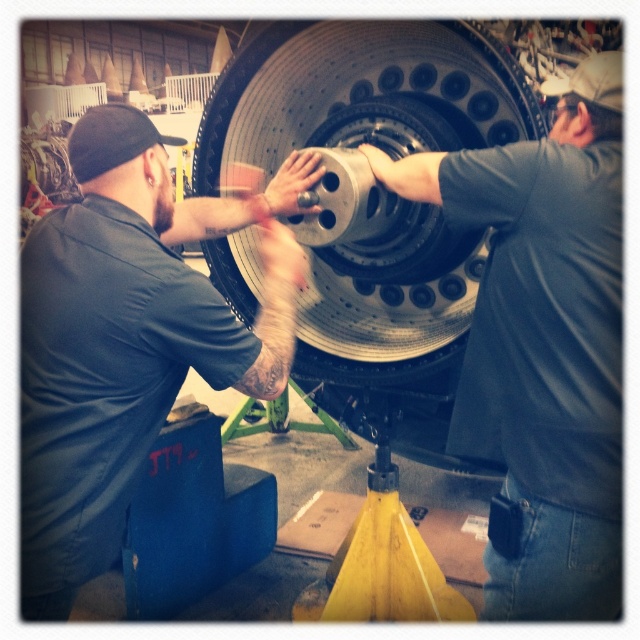
You are an inspector in the aircraft maintenance facility. You need to access the metallic silver tire at center for inspection. Is the matte black shirt at left blocking your direct path to it?

The matte black shirt at left is in front of the metallic silver tire at center, so yes, the matte black shirt at left is blocking the direct path to the metallic silver tire at center.

You are a mechanic working on an aircraft engine component. You need to choose between the matte black tire at center and the metallic silver tire at center for a specific part that requires a taller component. Which tire should you select?

The matte black tire at center is much taller than the metallic silver tire at center, so you should select the matte black tire at center for the part that requires a taller component.

You are standing in the industrial facility and need to identify the position of the matte black shirt at left relative to the matte black tire at center. From your perspective, which object is higher?

The matte black shirt at left is located above the matte black tire at center, so the matte black shirt at left is higher.